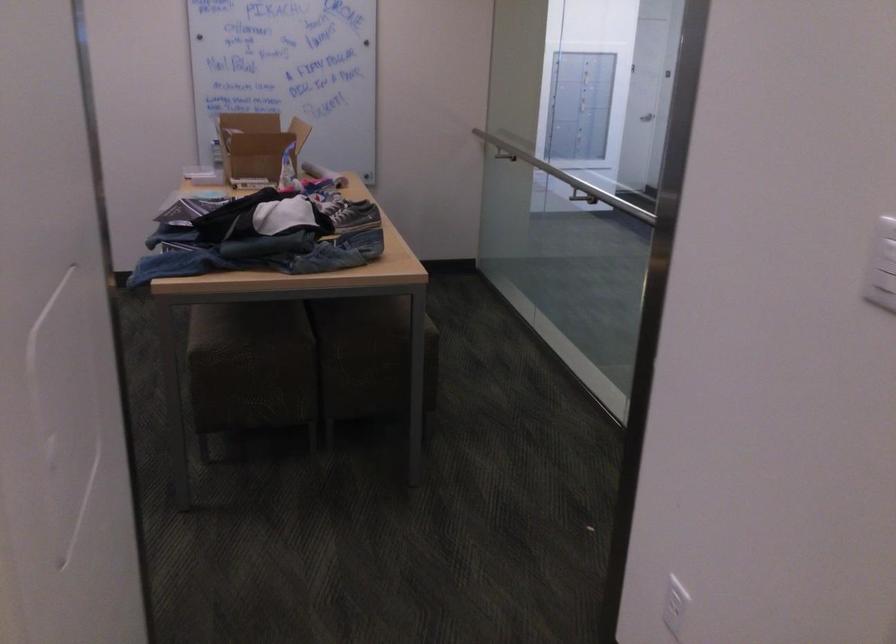
The width and height of the screenshot is (896, 644). Identify the location of metal handrail. (598, 193).